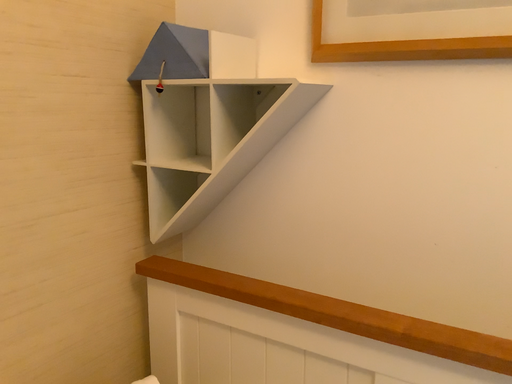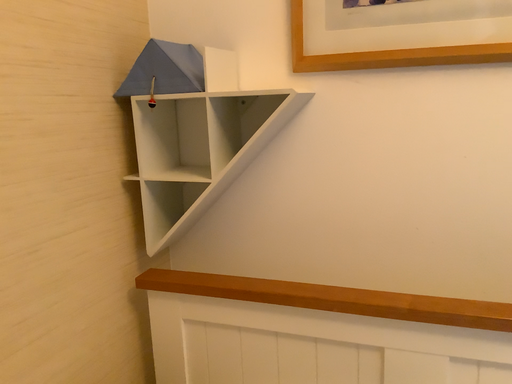
Question: How did the camera likely rotate when shooting the video?

Choices:
 (A) rotated left
 (B) rotated right

Answer: (B)